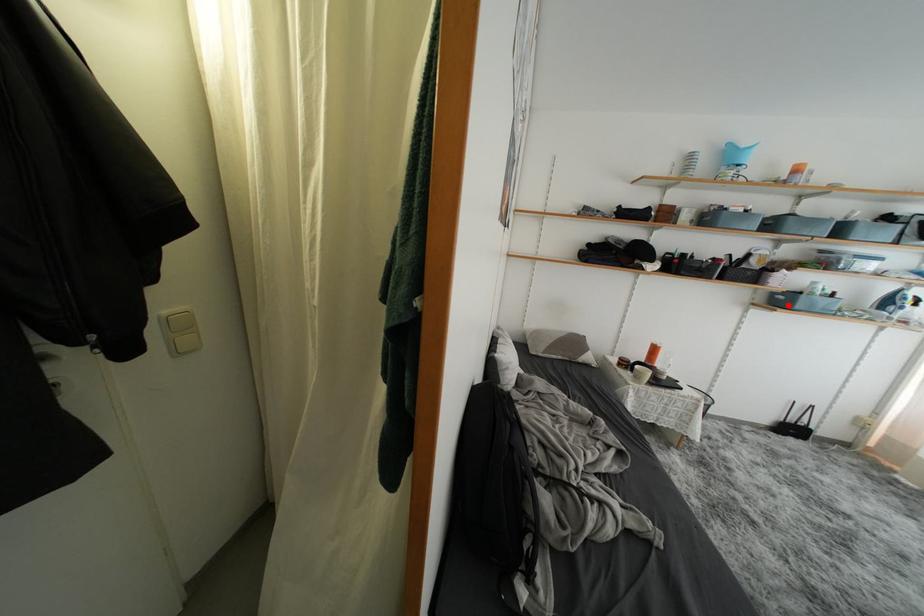
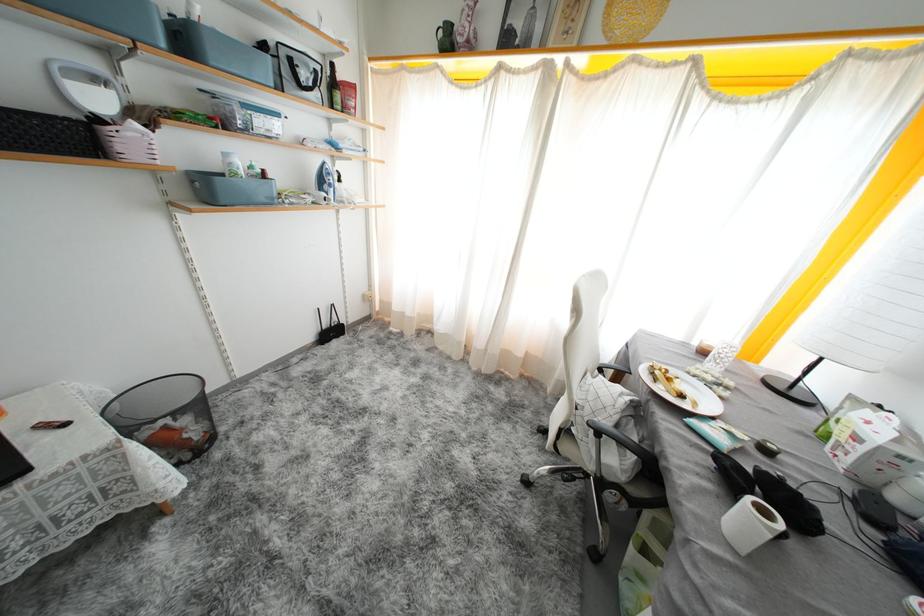
Question: I am providing you with two images of the same scene from different viewpoints. A red point is marked on the first image. Can you still see the location of the red point in image 2?

Choices:
 (A) Yes
 (B) No

Answer: (A)